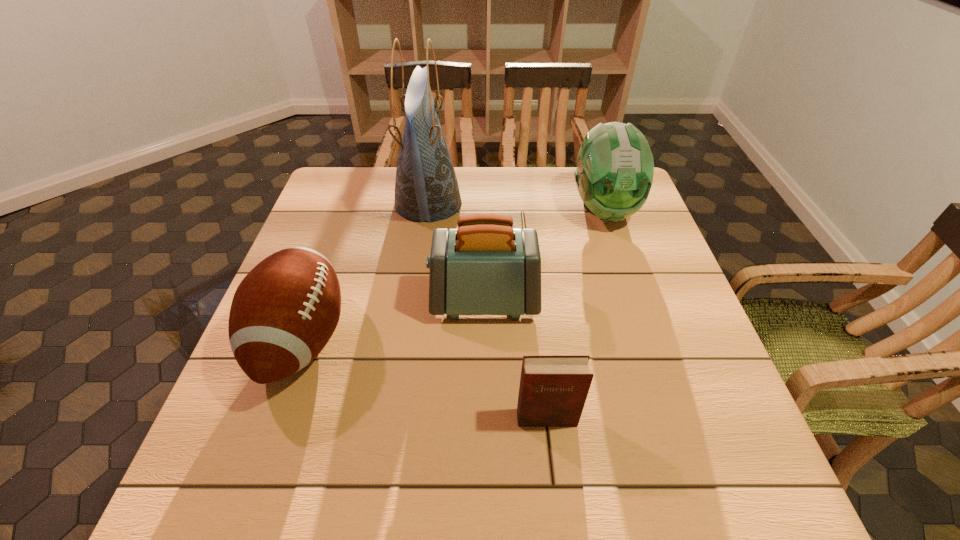
The height and width of the screenshot is (540, 960). Identify the location of vacant region located on the laces of the football. (406, 339).

Where is `vacant point located on the front cover of the shortest object`? The image size is (960, 540). vacant point located on the front cover of the shortest object is located at coordinates (550, 455).

Where is `shopping bag located at the far edge`? shopping bag located at the far edge is located at coordinates (426, 188).

Locate an element on the screen. The image size is (960, 540). football helmet that is at the far edge is located at coordinates pos(614,174).

Identify the location of object that is at the left edge. Image resolution: width=960 pixels, height=540 pixels. click(x=283, y=313).

Locate an element on the screen. This screenshot has width=960, height=540. object that is at the right edge is located at coordinates (614, 174).

Find the location of a particular element. object at the far right corner is located at coordinates (614, 174).

This screenshot has width=960, height=540. What are the coordinates of `vacant area at the far edge` in the screenshot? It's located at (566, 202).

The image size is (960, 540). I want to click on vacant space at the near edge, so click(519, 472).

Image resolution: width=960 pixels, height=540 pixels. In the image, there is a desktop. In order to click on free region at the right edge in this screenshot , I will do `click(626, 287)`.